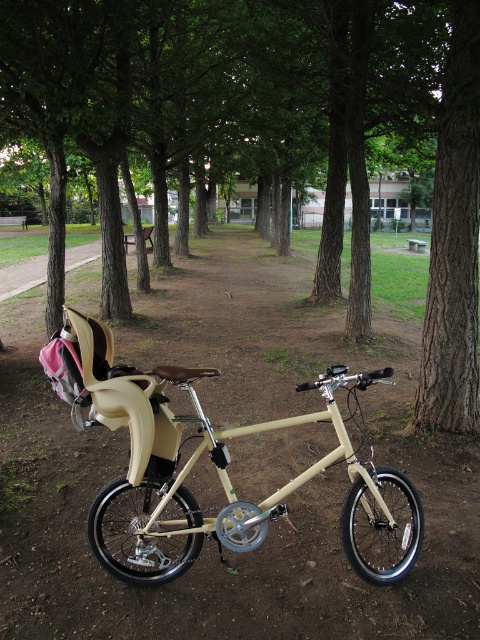
Question: Estimate the real-world distances between objects in this image. Which object is farther from the brown wood tree at center?

Choices:
 (A) beige matte bicycle at center
 (B) beige matte baby carriage at center

Answer: (B)

Question: Is beige matte bicycle at center above beige matte baby carriage at center?

Choices:
 (A) yes
 (B) no

Answer: (B)

Question: Is brown wood tree at center thinner than beige matte bicycle at center?

Choices:
 (A) no
 (B) yes

Answer: (A)

Question: Considering the real-world distances, which object is farthest from the brown wood tree at center?

Choices:
 (A) beige matte bicycle at center
 (B) beige matte baby carriage at center

Answer: (B)

Question: Which point appears farthest from the camera in this image?

Choices:
 (A) (120, 228)
 (B) (108, 346)
 (C) (372, 480)

Answer: (A)

Question: Can you confirm if brown wood tree at center is positioned below beige matte bicycle at center?

Choices:
 (A) yes
 (B) no

Answer: (B)